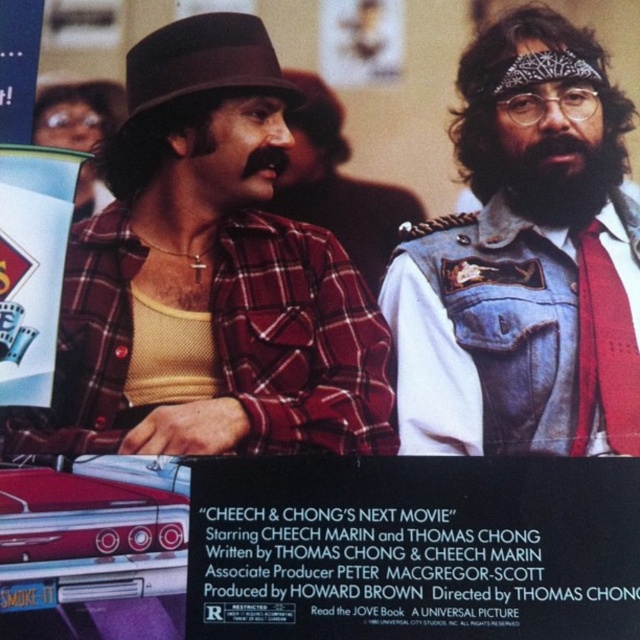
Question: Can you confirm if denim vest at right is positioned to the right of black paper at lower center?

Choices:
 (A) yes
 (B) no

Answer: (A)

Question: Can you confirm if black paper at lower center is bigger than dark brown fuzzy beard at upper right?

Choices:
 (A) no
 (B) yes

Answer: (B)

Question: Among these objects, which one is nearest to the camera?

Choices:
 (A) plaid shirt at left
 (B) black paper at lower center
 (C) denim vest at right

Answer: (B)

Question: Which object appears closest to the camera in this image?

Choices:
 (A) plaid shirt at left
 (B) black paper at lower center

Answer: (B)

Question: Which point appears farthest from the camera in this image?

Choices:
 (A) (294, 538)
 (B) (593, 380)
 (C) (284, 118)
 (D) (320, 108)

Answer: (D)

Question: Is denim vest at right wider than brown felt fedora at upper left?

Choices:
 (A) no
 (B) yes

Answer: (B)